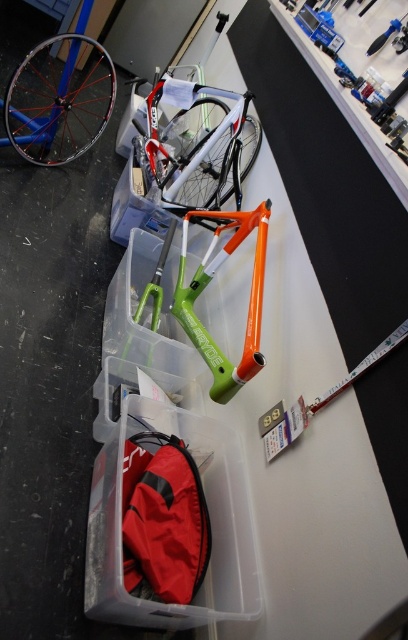
You are organizing bicycle parts in the workshop. You have a transparent plastic bag at lower center and a red fabric bag at lower left. Which bag can hold more items if you need to store some small bicycle parts?

The transparent plastic bag at lower center might be wider than red fabric bag at lower left, so it can potentially hold more small bicycle parts.

You are standing in the workshop and want to reach the point at coordinates point (x=223, y=428). If your arm can extend 4 feet, can you reach it without moving?

The point (x=223, y=428) is 4.86 feet from the viewer, which is beyond the 4 feet reach of your arm. You cannot reach it without moving.